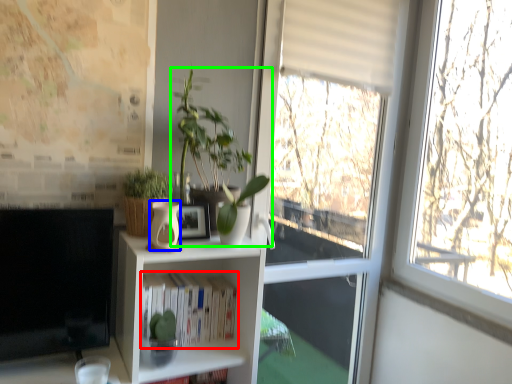
Question: Which object is positioned closest to book (highlighted by a red box)? Select from vase (highlighted by a blue box) and houseplant (highlighted by a green box).

Choices:
 (A) vase
 (B) houseplant

Answer: (A)